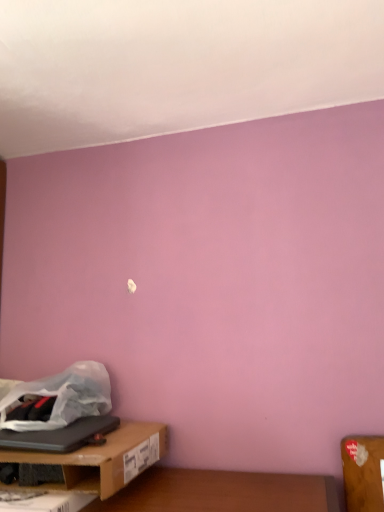
Looking at this image, what is the approximate height of black matte laptop at lower left?

black matte laptop at lower left is 1.37 inches tall.

What do you see at coordinates (63, 396) in the screenshot?
I see `translucent white plastic bag at lower left` at bounding box center [63, 396].

This screenshot has height=512, width=384. Find the location of `black matte laptop at lower left`. black matte laptop at lower left is located at coordinates (60, 435).

Considering the relative sizes of brown cardboard box at lower left and black matte laptop at lower left in the image provided, is brown cardboard box at lower left wider than black matte laptop at lower left?

Yes, brown cardboard box at lower left is wider than black matte laptop at lower left.

Which object is closer to the camera, brown cardboard box at lower left or black matte laptop at lower left?

brown cardboard box at lower left.

From a real-world perspective, is brown cardboard box at lower left on top of black matte laptop at lower left?

No.

This screenshot has width=384, height=512. Identify the location of table that is on the right side of black matte laptop at lower left. (102, 459).

Which of these two, brown cardboard box at lower left or translucent white plastic bag at lower left, is thinner?

translucent white plastic bag at lower left is thinner.

At what (x,y) coordinates should I click in order to perform the action: click on plastic bag located behind the brown cardboard box at lower left. Please return your answer as a coordinate pair (x, y). The width and height of the screenshot is (384, 512). Looking at the image, I should click on (63, 396).

From a real-world perspective, is brown cardboard box at lower left physically located above or below translucent white plastic bag at lower left?

In terms of real-world spatial position, brown cardboard box at lower left is below translucent white plastic bag at lower left.

Which object is further away from the camera taking this photo, translucent white plastic bag at lower left or brown cardboard box at lower left?

translucent white plastic bag at lower left is behind.

From the image's perspective, which one is positioned higher, translucent white plastic bag at lower left or brown cardboard box at lower left?

From the image's view, translucent white plastic bag at lower left is above.

Can we say translucent white plastic bag at lower left lies outside brown cardboard box at lower left?

Indeed, translucent white plastic bag at lower left is completely outside brown cardboard box at lower left.

I want to click on table lying below the translucent white plastic bag at lower left (from the image's perspective), so click(102, 459).

Considering the sizes of objects translucent white plastic bag at lower left and black matte laptop at lower left in the image provided, who is shorter, translucent white plastic bag at lower left or black matte laptop at lower left?

Standing shorter between the two is black matte laptop at lower left.

Does translucent white plastic bag at lower left lie in front of black matte laptop at lower left?

No, translucent white plastic bag at lower left is further to the viewer.

Is translucent white plastic bag at lower left at the right side of black matte laptop at lower left?

Correct, you'll find translucent white plastic bag at lower left to the right of black matte laptop at lower left.

Can you confirm if black matte laptop at lower left is wider than translucent white plastic bag at lower left?

Yes.

From a real-world perspective, who is located lower, black matte laptop at lower left or translucent white plastic bag at lower left?

From a 3D spatial view, black matte laptop at lower left is below.

From the image's perspective, between black matte laptop at lower left and translucent white plastic bag at lower left, who is located below?

black matte laptop at lower left is shown below in the image.

Considering the relative positions of black matte laptop at lower left and brown cardboard box at lower left in the image provided, is black matte laptop at lower left to the left or to the right of brown cardboard box at lower left?

black matte laptop at lower left is to the left of brown cardboard box at lower left.

From the image's perspective, which one is positioned lower, black matte laptop at lower left or brown cardboard box at lower left?

brown cardboard box at lower left, from the image's perspective.

Is black matte laptop at lower left taller or shorter than brown cardboard box at lower left?

Considering their sizes, black matte laptop at lower left has less height than brown cardboard box at lower left.

Where is `table in front of the black matte laptop at lower left`? table in front of the black matte laptop at lower left is located at coordinates (102, 459).

Locate an element on the screen. This screenshot has width=384, height=512. plastic bag above the brown cardboard box at lower left (from the image's perspective) is located at coordinates (63, 396).

Looking at the image, which one is located further to brown cardboard box at lower left, black matte laptop at lower left or translucent white plastic bag at lower left?

translucent white plastic bag at lower left is positioned further to the anchor brown cardboard box at lower left.

Considering their positions, is translucent white plastic bag at lower left positioned closer to black matte laptop at lower left than brown cardboard box at lower left?

Among the two, brown cardboard box at lower left is located nearer to black matte laptop at lower left.

Looking at this image, which object lies nearer to the anchor point black matte laptop at lower left, brown cardboard box at lower left or translucent white plastic bag at lower left?

brown cardboard box at lower left.

Estimate the real-world distances between objects in this image. Which object is further from brown cardboard box at lower left, translucent white plastic bag at lower left or black matte laptop at lower left?

translucent white plastic bag at lower left is further to brown cardboard box at lower left.

From the image, which object appears to be nearer to translucent white plastic bag at lower left, brown cardboard box at lower left or black matte laptop at lower left?

black matte laptop at lower left is positioned closer to the anchor translucent white plastic bag at lower left.

When comparing their distances from translucent white plastic bag at lower left, does black matte laptop at lower left or brown cardboard box at lower left seem further?

Based on the image, brown cardboard box at lower left appears to be further to translucent white plastic bag at lower left.

This screenshot has width=384, height=512. In order to click on laptop positioned between brown cardboard box at lower left and translucent white plastic bag at lower left from near to far in this screenshot , I will do `click(60, 435)`.